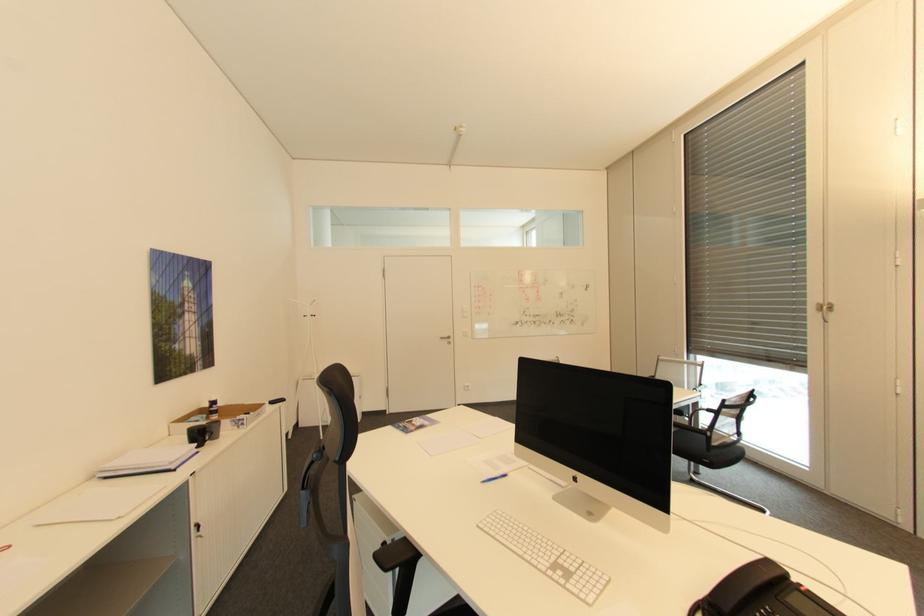
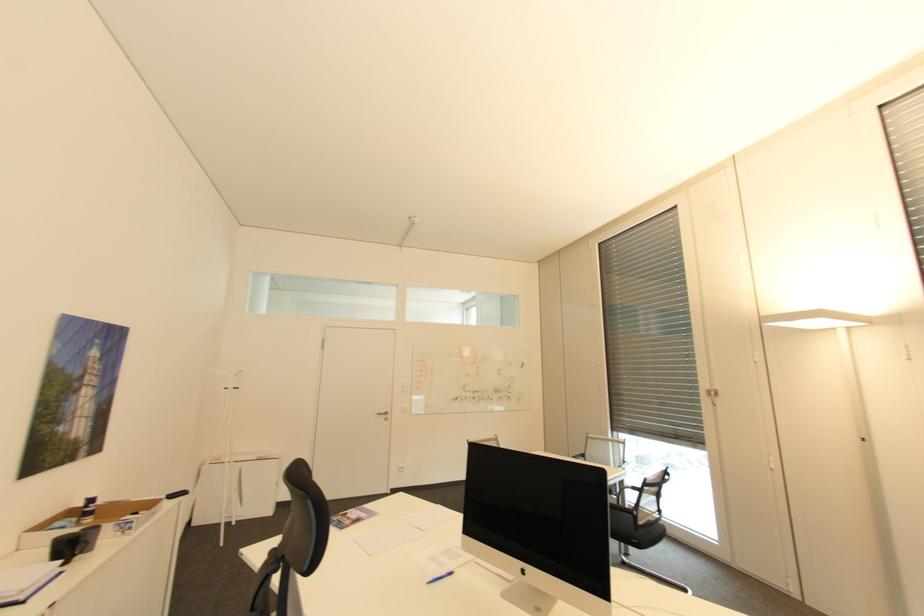
Locate, in the second image, the point that corresponds to point 488,480 in the first image.

(434, 582)